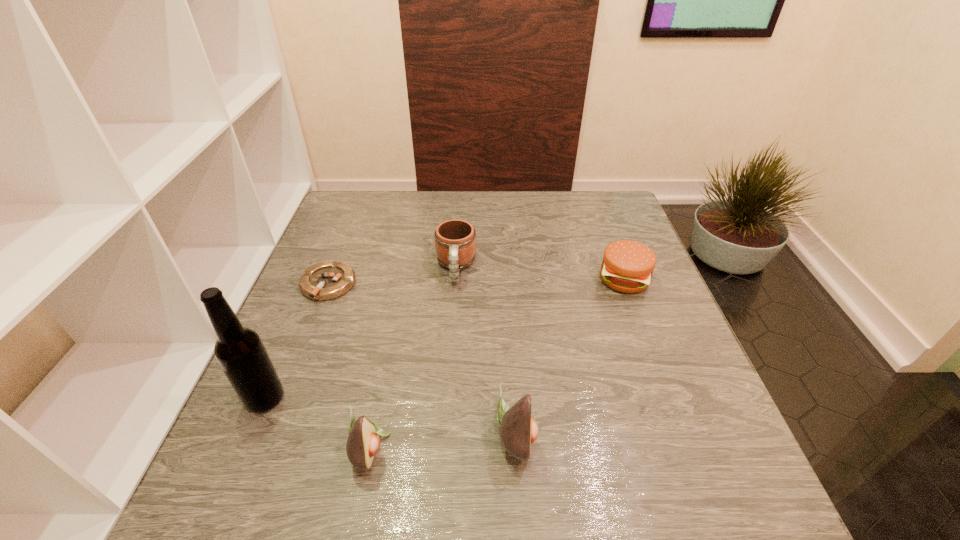
This screenshot has height=540, width=960. I want to click on empty space between the rightmost object and the fifth object from left to right, so click(x=570, y=356).

Find the location of a particular element. The image size is (960, 540). empty space between the third object from right to left and the left avocado is located at coordinates (413, 357).

This screenshot has width=960, height=540. Find the location of `free point between the tallest object and the hamburger`. free point between the tallest object and the hamburger is located at coordinates (444, 339).

I want to click on empty location between the tallest object and the ashtray, so click(x=297, y=342).

In order to click on object that is the second closest one to the ashtray in this screenshot , I will do `click(240, 352)`.

Point out which object is positioned as the second nearest to the hamburger. Please provide its 2D coordinates. Your answer should be formatted as a tuple, i.e. [(x, y)], where the tuple contains the x and y coordinates of a point satisfying the conditions above.

[(518, 430)]

The height and width of the screenshot is (540, 960). I want to click on vacant space that satisfies the following two spatial constraints: 1. on the back side of the ashtray; 2. on the right side of the rightmost object, so click(330, 279).